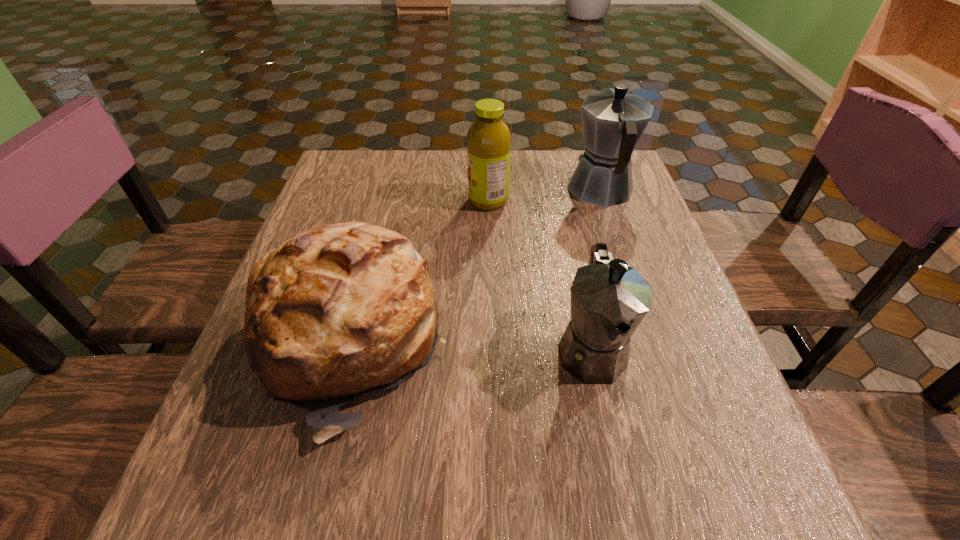
The width and height of the screenshot is (960, 540). I want to click on fruit juice that is at the far edge, so click(489, 138).

Where is `object at the left edge`? This screenshot has height=540, width=960. object at the left edge is located at coordinates (340, 310).

Where is `object that is at the far right corner`? This screenshot has height=540, width=960. object that is at the far right corner is located at coordinates (613, 121).

The height and width of the screenshot is (540, 960). I want to click on vacant space at the far edge of the desktop, so click(x=442, y=151).

Where is `free space at the right edge of the desktop`? This screenshot has width=960, height=540. free space at the right edge of the desktop is located at coordinates (686, 397).

This screenshot has height=540, width=960. Find the location of `vacant space at the far left corner`. vacant space at the far left corner is located at coordinates (376, 159).

Where is `free space at the far right corner of the desktop`? The width and height of the screenshot is (960, 540). free space at the far right corner of the desktop is located at coordinates (572, 149).

This screenshot has width=960, height=540. What are the coordinates of `blank region between the leftmost object and the taller coffeepot` in the screenshot? It's located at (475, 267).

This screenshot has height=540, width=960. What are the coordinates of `unoccupied position between the fruit juice and the taller coffeepot` in the screenshot? It's located at (544, 195).

This screenshot has width=960, height=540. In order to click on free space between the bread and the farther coffeepot in this screenshot , I will do `click(475, 267)`.